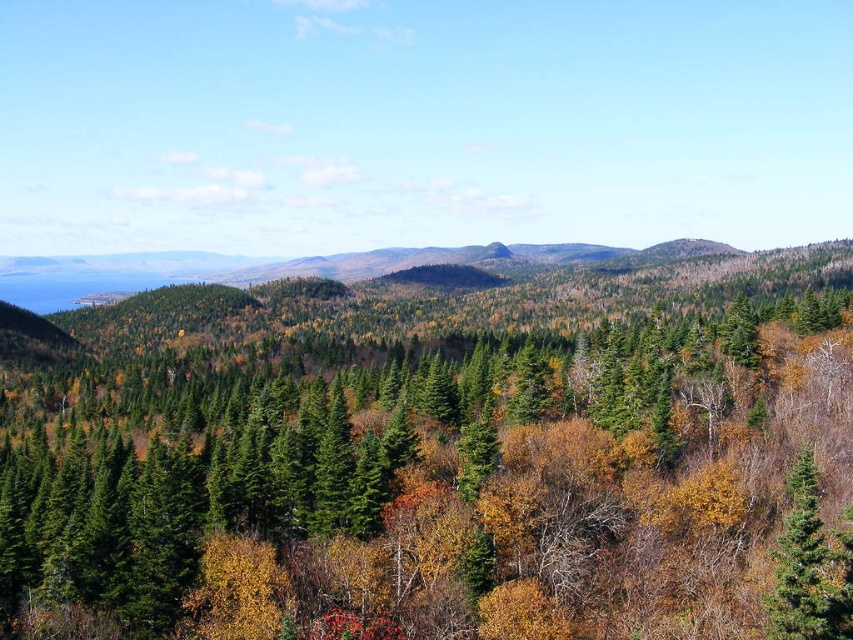
Question: Observing the image, what is the correct spatial positioning of green matte trees at center in reference to green glossy evergreen tree at center-right?

Choices:
 (A) above
 (B) below

Answer: (A)

Question: Does green matte trees at center have a smaller size compared to green glossy evergreen tree at center-right?

Choices:
 (A) no
 (B) yes

Answer: (A)

Question: Can you confirm if green matte trees at center is positioned to the left of green glossy evergreen tree at center-right?

Choices:
 (A) yes
 (B) no

Answer: (A)

Question: Among these points, which one is farthest from the camera?

Choices:
 (A) (809, 596)
 (B) (129, 490)

Answer: (B)